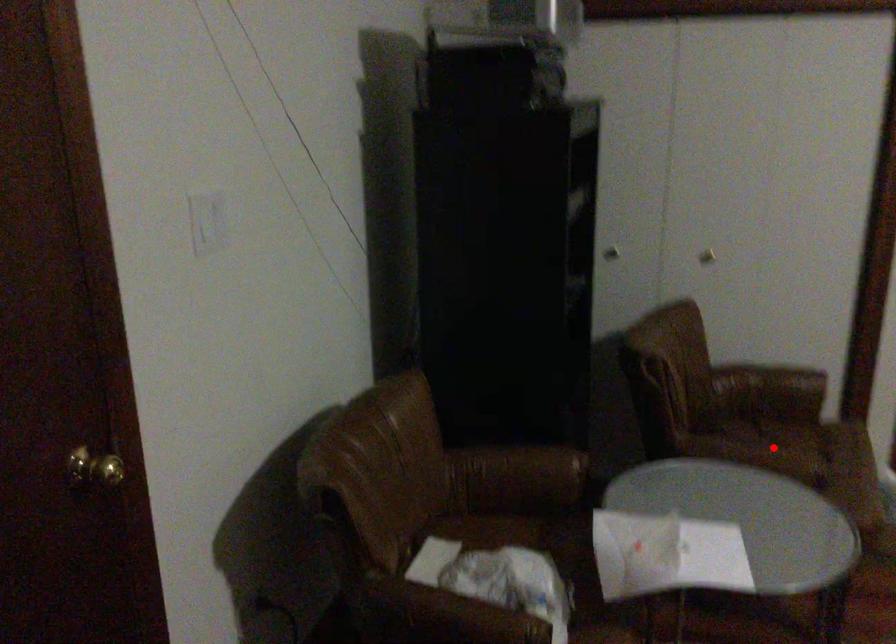
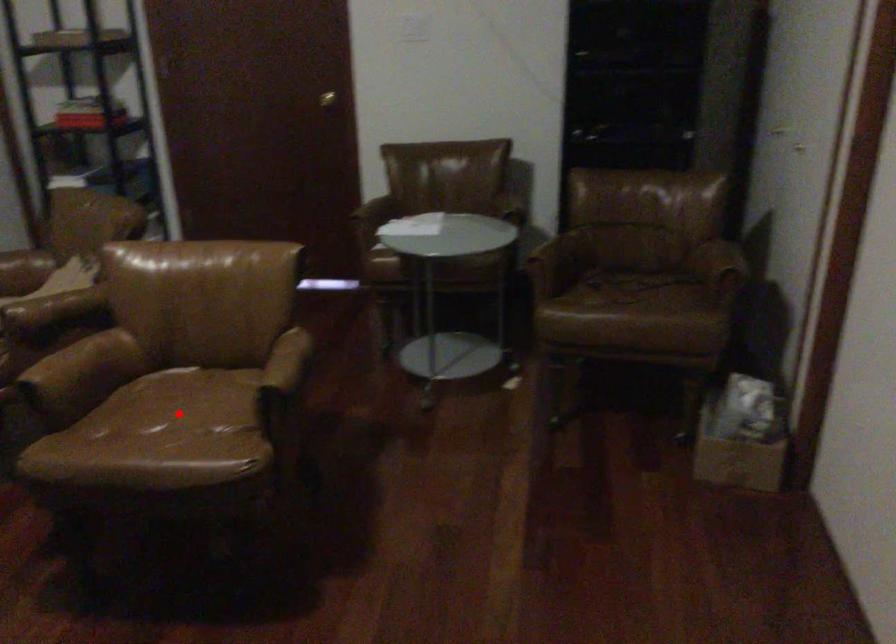
I am providing you with two images of the same scene from different viewpoints. A red point is marked on the first image and another point is marked on the second image. Does the point marked in image1 correspond to the same location as the one in image2?

No